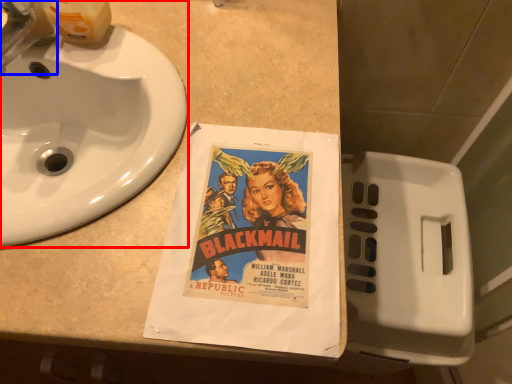
Question: Among these objects, which one is nearest to the camera, sink (highlighted by a red box) or faucet (highlighted by a blue box)?

Choices:
 (A) sink
 (B) faucet

Answer: (A)